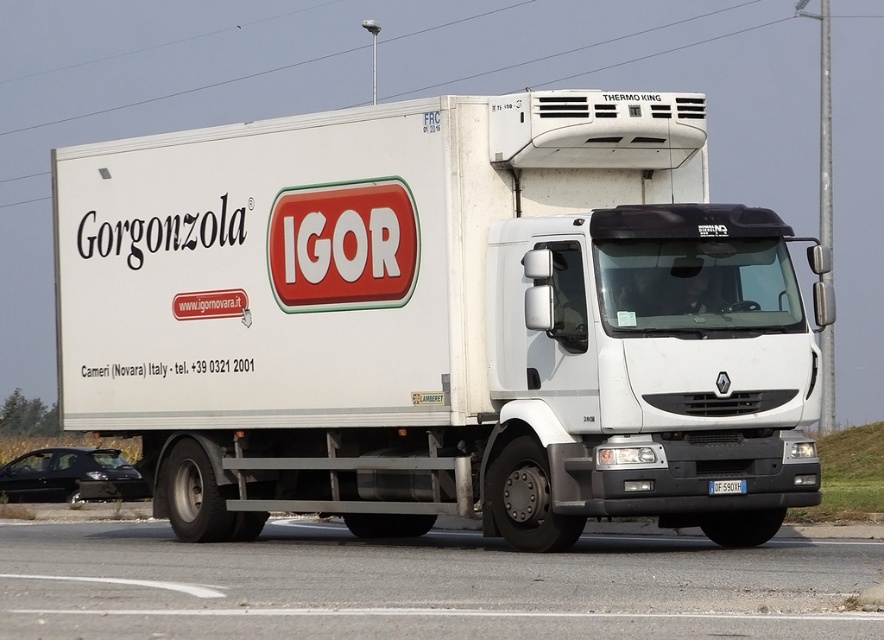
You are a traffic officer who needs to check the license plate of the vehicle. Based on the image, can you easily see the white plastic license plate at center from the position of the white matte trailer truck at center?

The white matte trailer truck at center is above the white plastic license plate at center, so the license plate is located below the truck and should be visible from the front or side, making it accessible for inspection.

You are standing at a crosswalk and see a white matte trailer truck at center approaching. If the truck is moving at 30 km per hour, how many seconds will it take for the truck to reach you?

The white matte trailer truck at center and camera are 13.73 meters apart. At 30 km per hour, the truck is moving at approximately 8.33 meters per second. Dividing the distance by speed gives 13.73 meters divided by 8.33 mps equals approximately 1.65 seconds. So, the truck will reach you in about 1.65 seconds.